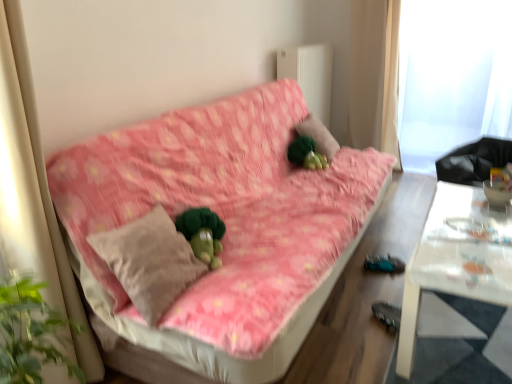
At what (x,y) coordinates should I click in order to perform the action: click on vacant space underneath white glossy table at right (from a real-world perspective). Please return your answer as a coordinate pair (x, y). Looking at the image, I should click on (468, 338).